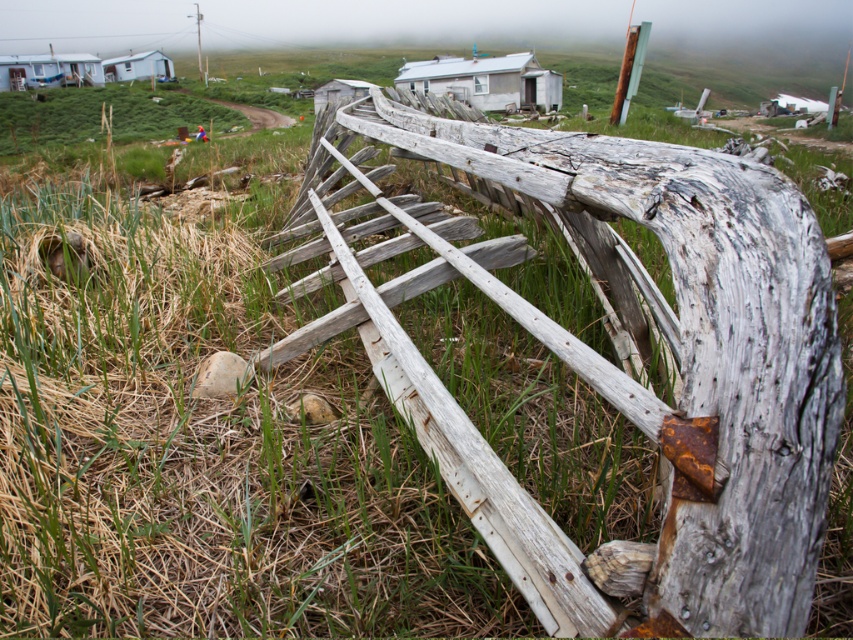
Question: Considering the relative positions of weathered wood fence at center and white wooden hut at upper left in the image provided, where is weathered wood fence at center located with respect to white wooden hut at upper left?

Choices:
 (A) left
 (B) right

Answer: (B)

Question: Is weathered wood fence at center further to camera compared to white plastic hut at upper left?

Choices:
 (A) yes
 (B) no

Answer: (B)

Question: Which object appears closest to the camera in this image?

Choices:
 (A) weathered wood fence at center
 (B) white wooden hut at center
 (C) white plastic hut at upper left

Answer: (A)

Question: Which point is closer to the camera?

Choices:
 (A) white plastic hut at upper left
 (B) white wooden hut at upper left
 (C) weathered wood fence at center

Answer: (C)

Question: Which object is the closest to the white plastic hut at upper left?

Choices:
 (A) white wooden hut at center
 (B) weathered wood fence at center
 (C) white wooden hut at upper left

Answer: (C)

Question: Can you confirm if weathered wood fence at center is positioned to the left of white plastic hut at upper left?

Choices:
 (A) yes
 (B) no

Answer: (B)